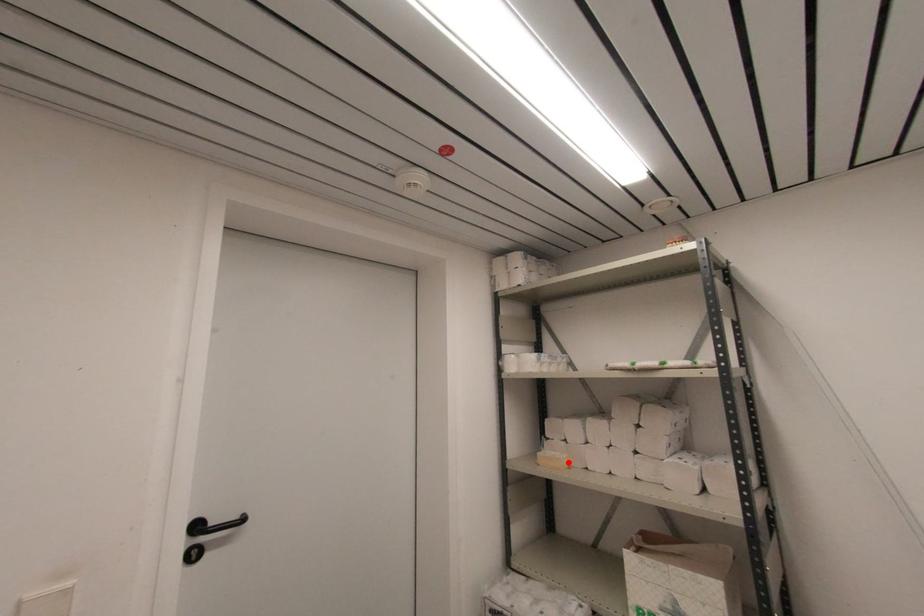
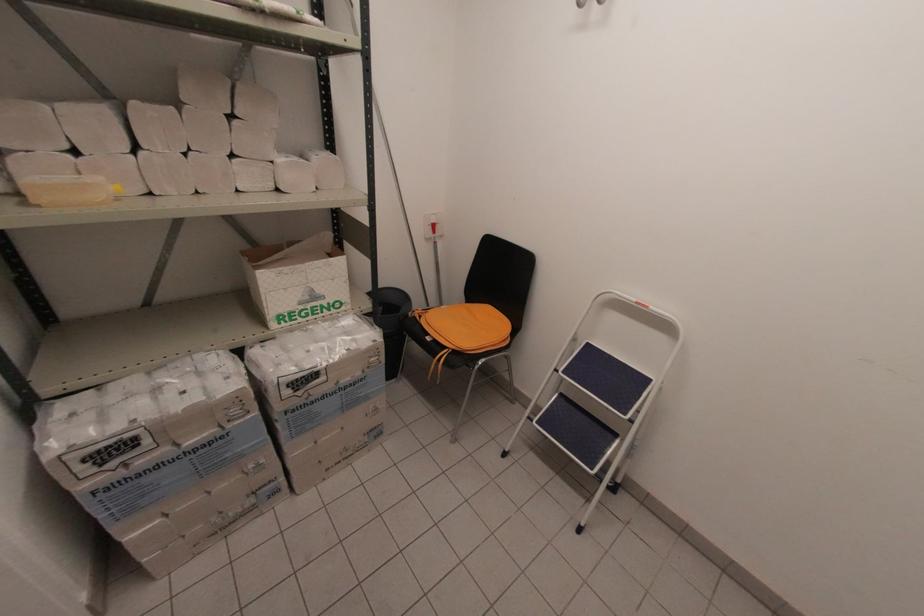
Locate, in the second image, the point that corresponds to the highlighted location in the first image.

(116, 188)